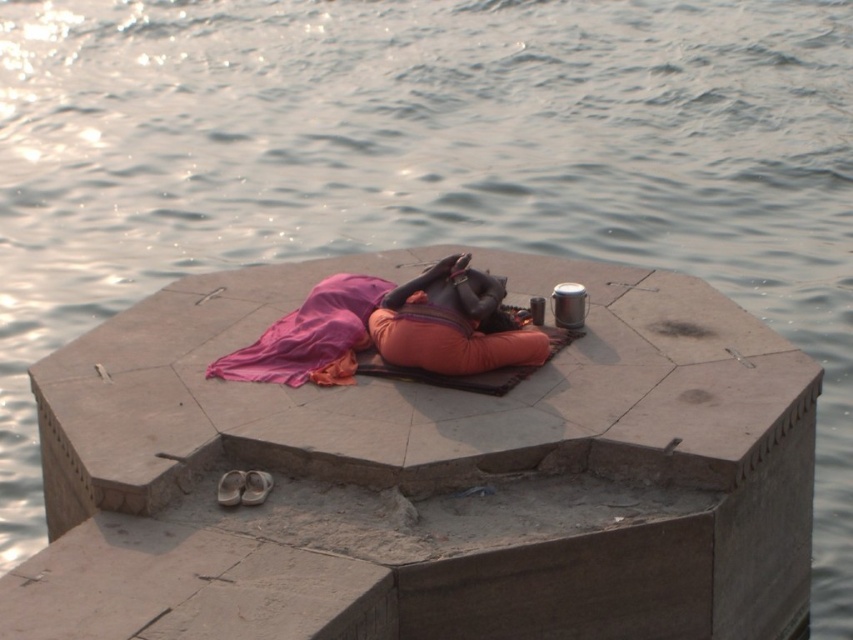
The width and height of the screenshot is (853, 640). What do you see at coordinates (451, 323) in the screenshot?
I see `orange fabric at center` at bounding box center [451, 323].

Between orange fabric at center and pink fabric at center, which one has less height?

With less height is pink fabric at center.

You are a GUI agent. You are given a task and a screenshot of the screen. Output one action in this format:
    pyautogui.click(x=<x>, y=<y>)
    Task: Click on the orange fabric at center
    
    Given the screenshot: What is the action you would take?
    pyautogui.click(x=451, y=323)

This screenshot has width=853, height=640. Identify the location of orange fabric at center. point(451,323).